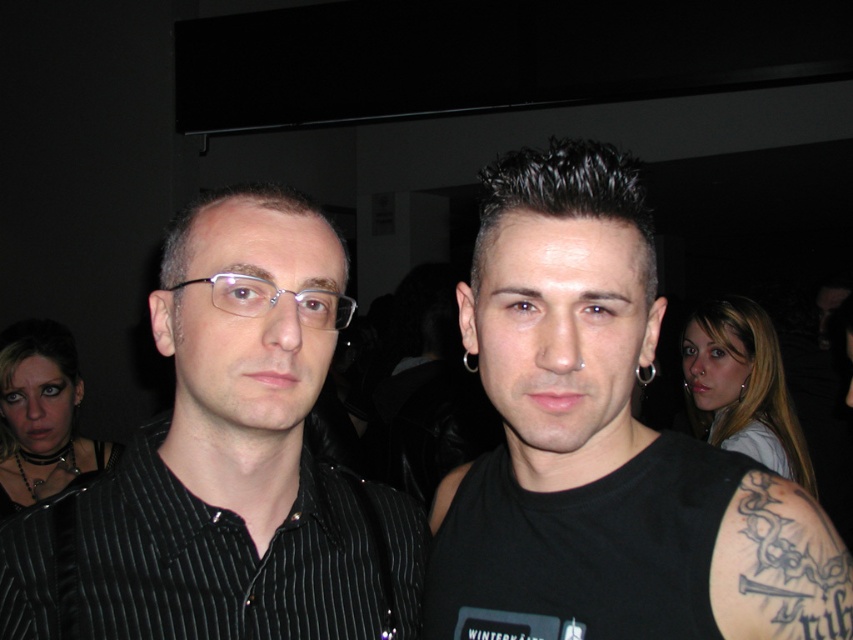
You are a photographer at a party and want to take a closeup of the black matte tank top at center and the clear plastic glasses at center. Which one should you focus on to ensure it appears sharp in the photo?

The black matte tank top at center is closer to the viewer than clear plastic glasses at center, so focusing on the black matte tank top at center will ensure it appears sharp. The clear plastic glasses at center may appear blurry due to its distance from the camera.

You are organizing a costume party and need to ensure that all accessories fit properly. You have a pair of clear plastic glasses at center and a black pinstripe shirt at left. Which item requires a larger size to accommodate its dimensions?

The black pinstripe shirt at left requires a larger size because it is larger in size than the clear plastic glasses at center.